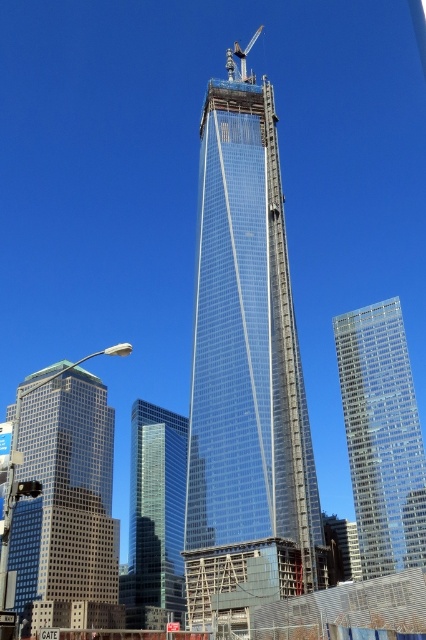
Is transparent glass building at right wider than clear glass skyscraper at center?

Incorrect, transparent glass building at right's width does not surpass clear glass skyscraper at center's.

Does transparent glass building at right have a lesser width compared to clear glass skyscraper at center?

Indeed, transparent glass building at right has a lesser width compared to clear glass skyscraper at center.

Between point (365, 344) and point (134, 621), which one is positioned in front?

Point (134, 621) is in front.

Where is `transparent glass building at right`? transparent glass building at right is located at coordinates (382, 436).

Which of these two, glassy reflective skyscraper at left or clear glass skyscraper at center, stands shorter?

With less height is glassy reflective skyscraper at left.

Who is positioned more to the left, glassy reflective skyscraper at left or clear glass skyscraper at center?

From the viewer's perspective, glassy reflective skyscraper at left appears more on the left side.

Does point (89, 388) come behind point (144, 579)?

No, it is not.

Image resolution: width=426 pixels, height=640 pixels. Find the location of `glassy reflective skyscraper at left`. glassy reflective skyscraper at left is located at coordinates (71, 483).

Is point (94, 508) less distant than point (241, 65)?

Yes.

Can you confirm if glassy reflective skyscraper at left is positioned to the right of metallic gray crane at upper center?

Incorrect, glassy reflective skyscraper at left is not on the right side of metallic gray crane at upper center.

Find the location of a particular element. The width and height of the screenshot is (426, 640). glassy reflective skyscraper at left is located at coordinates (71, 483).